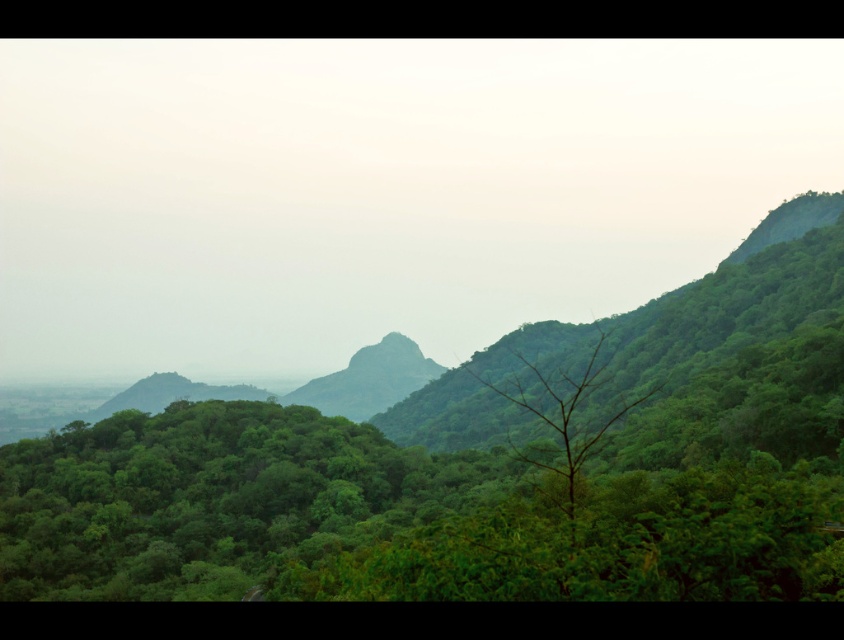
You are a hiker standing in the middle of the landscape and want to take a photo of both the green leafy tree at center and the green rock at center. Which object should you zoom in on to ensure both fit in the frame?

The green leafy tree at center is wider than the green rock at center, so you should zoom out slightly to capture both in the frame.

You are an environmental scientist assessing the landscape. You need to determine which object, the green leafy tree at center or the green rock at center, would cast a larger shadow during midday. Based on their heights, which one would have a bigger shadow?

The green leafy tree at center is taller than the green rock at center, so it would cast a larger shadow during midday.